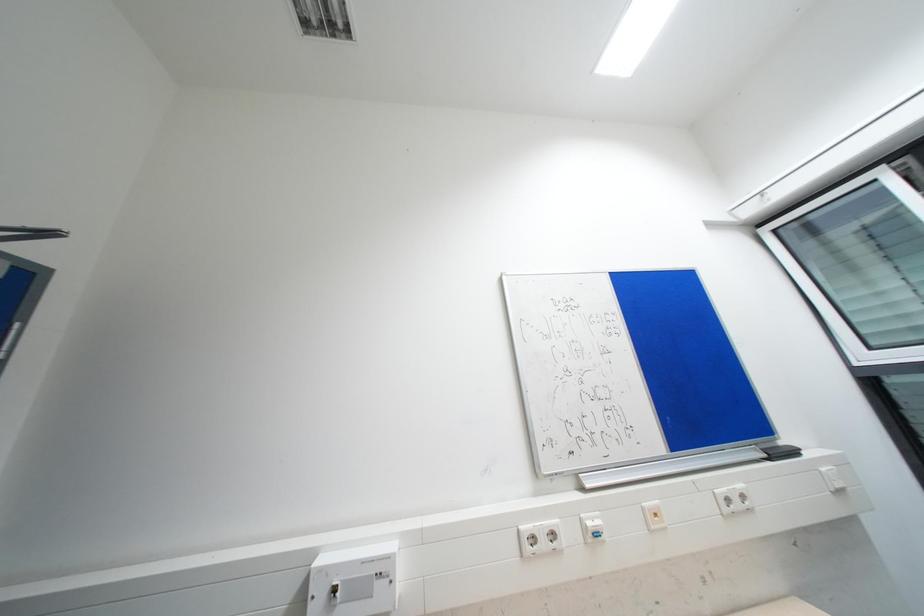
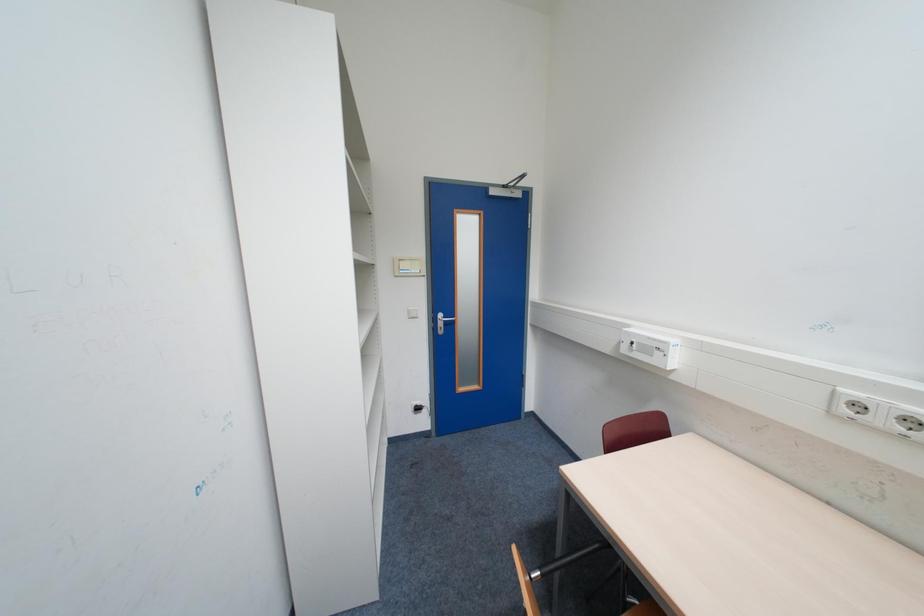
The images are taken continuously from a first-person perspective. In which direction is your viewpoint rotating?

The camera rotated toward left-down.